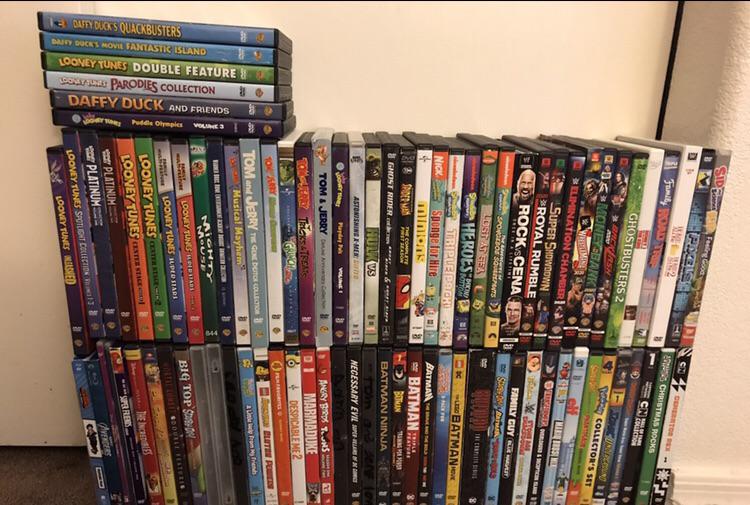
The height and width of the screenshot is (505, 750). I want to click on horizontal dvd cases, so click(x=171, y=29), click(x=171, y=44), click(x=172, y=65), click(x=170, y=84), click(x=169, y=102), click(x=168, y=122).